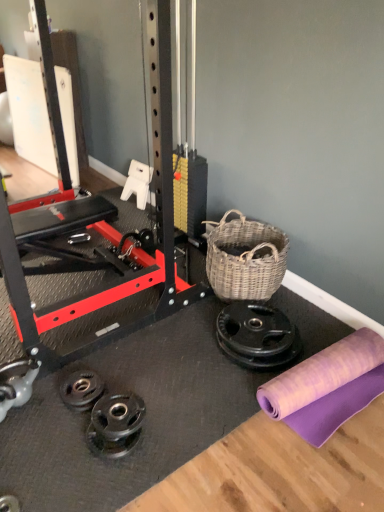
Question: Does purple fabric at lower right come behind woven natural basket at center-right?

Choices:
 (A) yes
 (B) no

Answer: (B)

Question: Does purple fabric at lower right have a greater width compared to woven natural basket at center-right?

Choices:
 (A) yes
 (B) no

Answer: (A)

Question: Is woven natural basket at center-right surrounded by purple fabric at lower right?

Choices:
 (A) yes
 (B) no

Answer: (B)

Question: Can you confirm if purple fabric at lower right is positioned to the right of woven natural basket at center-right?

Choices:
 (A) no
 (B) yes

Answer: (B)

Question: From a real-world perspective, does purple fabric at lower right stand above woven natural basket at center-right?

Choices:
 (A) no
 (B) yes

Answer: (A)

Question: Is black rubber weight plate at lower left taller or shorter than woven natural basket at center-right?

Choices:
 (A) short
 (B) tall

Answer: (A)

Question: Is black rubber weight plate at lower left inside the boundaries of woven natural basket at center-right, or outside?

Choices:
 (A) outside
 (B) inside

Answer: (A)

Question: Based on their positions, is black rubber weight plate at lower left located to the left or right of woven natural basket at center-right?

Choices:
 (A) right
 (B) left

Answer: (B)

Question: Is black rubber weight plate at lower left in front of or behind woven natural basket at center-right in the image?

Choices:
 (A) behind
 (B) front

Answer: (B)

Question: Is point (69, 394) closer or farther from the camera than point (322, 382)?

Choices:
 (A) farther
 (B) closer

Answer: (A)

Question: In the image, is black rubber weight plate at lower left positioned in front of or behind purple fabric at lower right?

Choices:
 (A) behind
 (B) front

Answer: (A)

Question: From a real-world perspective, is black rubber weight plate at lower left physically located above or below purple fabric at lower right?

Choices:
 (A) below
 (B) above

Answer: (A)

Question: Is black rubber weight plate at lower left wider or thinner than purple fabric at lower right?

Choices:
 (A) thin
 (B) wide

Answer: (A)

Question: From the image's perspective, is woven natural basket at center-right positioned above or below black rubber weight plate at lower left?

Choices:
 (A) above
 (B) below

Answer: (A)

Question: Based on their positions, is woven natural basket at center-right located to the left or right of black rubber weight plate at lower left?

Choices:
 (A) left
 (B) right

Answer: (B)